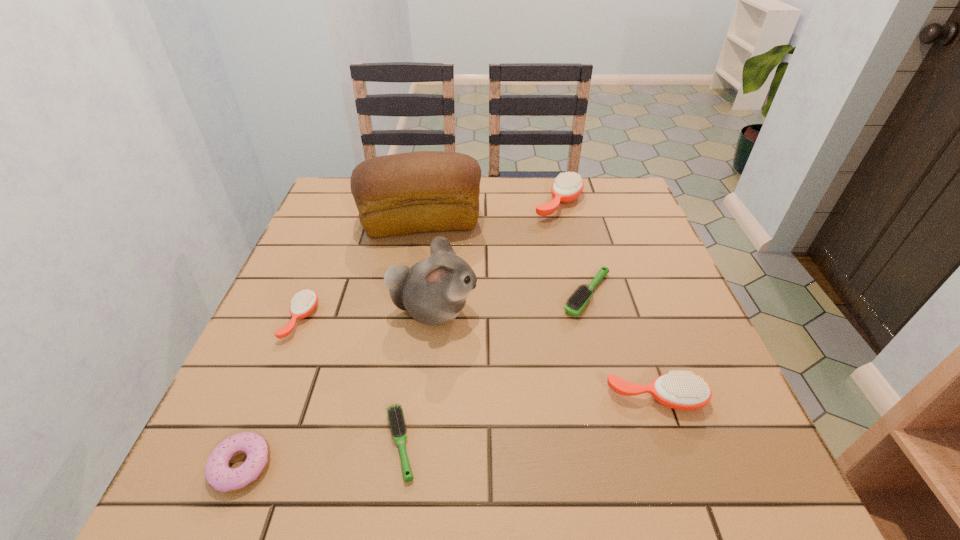
This screenshot has width=960, height=540. Identify the location of the fourth closest hairbrush relative to the pink doughnut. (575, 304).

Locate an element on the screen. orange hairbrush object that ranks as the second closest to the second biggest orange hairbrush is located at coordinates (303, 303).

Where is `orange hairbrush that is the closest to the fourth hairbrush from right to left`? This screenshot has height=540, width=960. orange hairbrush that is the closest to the fourth hairbrush from right to left is located at coordinates point(303,303).

Where is `free space in the image that satisfies the following two spatial constraints: 1. on the back side of the third tallest object; 2. on the right side of the brown bread`? This screenshot has height=540, width=960. free space in the image that satisfies the following two spatial constraints: 1. on the back side of the third tallest object; 2. on the right side of the brown bread is located at coordinates (424, 203).